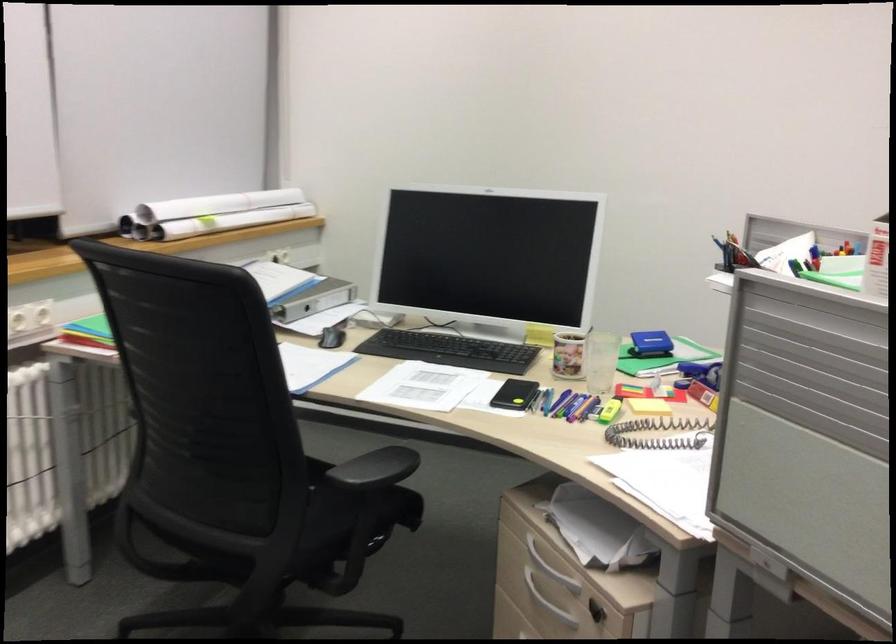
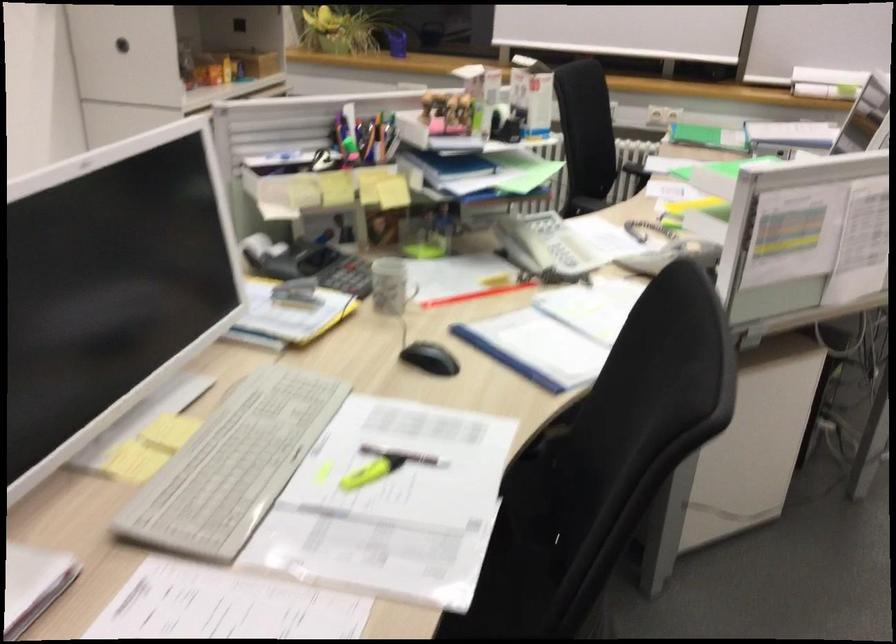
Question: I am providing you with two images of the same scene from different viewpoints. Please identify which objects are invisible in image2.

Choices:
 (A) patterned mug
 (B) colorful push pin
 (C) black chair armrest
 (D) chair sitting surface

Answer: (D)